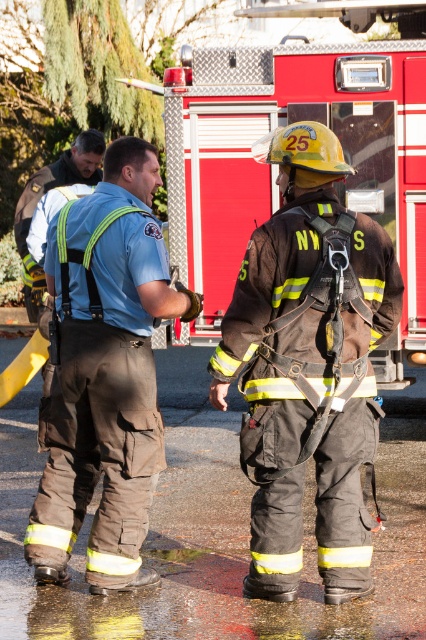
You are a new firefighter arriving at the scene and need to locate the red metallic fire truck at center. Based on the description, where should you look relative to the brown leather jacket at upper left?

The red metallic fire truck at center is located below the brown leather jacket at upper left, so you should look downward from the brown leather jacket at upper left to find it.